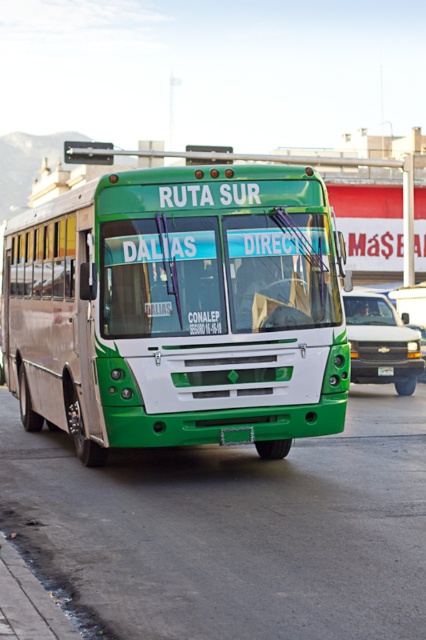
Question: Which object appears farthest from the camera in this image?

Choices:
 (A) matte white truck at center
 (B) green matte bus at center

Answer: (A)

Question: Is green matte bus at center further to camera compared to matte white truck at center?

Choices:
 (A) no
 (B) yes

Answer: (A)

Question: Can you confirm if matte white truck at center is bigger than green matte license plate at center?

Choices:
 (A) yes
 (B) no

Answer: (A)

Question: Is green matte bus at center above matte white truck at center?

Choices:
 (A) yes
 (B) no

Answer: (A)

Question: Among these points, which one is nearest to the camera?

Choices:
 (A) (383, 376)
 (B) (357, 308)

Answer: (A)

Question: Which object appears closest to the camera in this image?

Choices:
 (A) green matte bus at center
 (B) matte white truck at center
 (C) green matte license plate at center

Answer: (A)